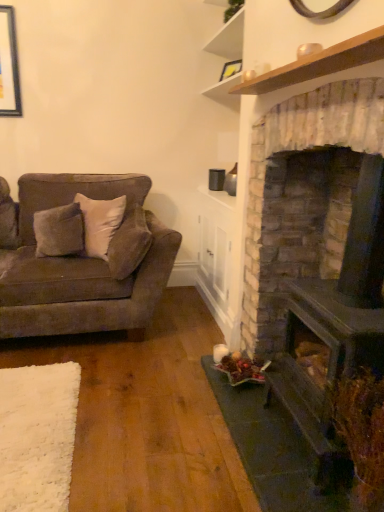
Question: From a real-world perspective, does dark brown stone fireplace at right sit lower than suede-like brown couch at left?

Choices:
 (A) yes
 (B) no

Answer: (B)

Question: Are dark brown stone fireplace at right and suede-like brown couch at left far apart?

Choices:
 (A) no
 (B) yes

Answer: (B)

Question: From the image's perspective, is dark brown stone fireplace at right below suede-like brown couch at left?

Choices:
 (A) no
 (B) yes

Answer: (B)

Question: Does dark brown stone fireplace at right touch suede-like brown couch at left?

Choices:
 (A) yes
 (B) no

Answer: (B)

Question: Is dark brown stone fireplace at right not within suede-like brown couch at left?

Choices:
 (A) no
 (B) yes

Answer: (B)

Question: Looking at their shapes, would you say dark brown stone fireplace at right is wider or thinner than suede-like beige pillow at center-left?

Choices:
 (A) thin
 (B) wide

Answer: (B)

Question: From a real-world perspective, is dark brown stone fireplace at right positioned above or below suede-like beige pillow at center-left?

Choices:
 (A) below
 (B) above

Answer: (B)

Question: Is point (264, 135) positioned closer to the camera than point (130, 214)?

Choices:
 (A) farther
 (B) closer

Answer: (B)

Question: In terms of size, does dark brown stone fireplace at right appear bigger or smaller than suede-like beige pillow at center-left?

Choices:
 (A) small
 (B) big

Answer: (B)

Question: Is point (117, 230) positioned closer to the camera than point (329, 343)?

Choices:
 (A) closer
 (B) farther

Answer: (B)

Question: Do you think suede-like beige pillow at center-left is within dark brown stone fireplace at right, or outside of it?

Choices:
 (A) inside
 (B) outside

Answer: (B)

Question: From the image's perspective, relative to dark brown stone fireplace at right, is suede-like beige pillow at center-left above or below?

Choices:
 (A) below
 (B) above

Answer: (B)

Question: From their relative heights in the image, would you say suede-like beige pillow at center-left is taller or shorter than dark brown stone fireplace at right?

Choices:
 (A) tall
 (B) short

Answer: (B)

Question: In terms of width, does suede-like beige pillow at center-left look wider or thinner when compared to suede-like brown couch at left?

Choices:
 (A) wide
 (B) thin

Answer: (B)

Question: Is suede-like beige pillow at center-left bigger or smaller than suede-like brown couch at left?

Choices:
 (A) big
 (B) small

Answer: (B)